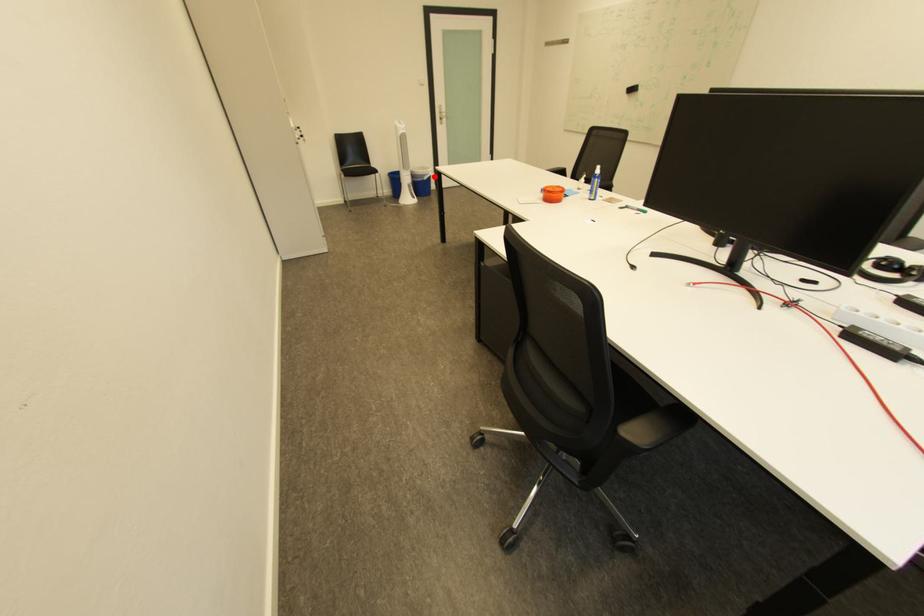
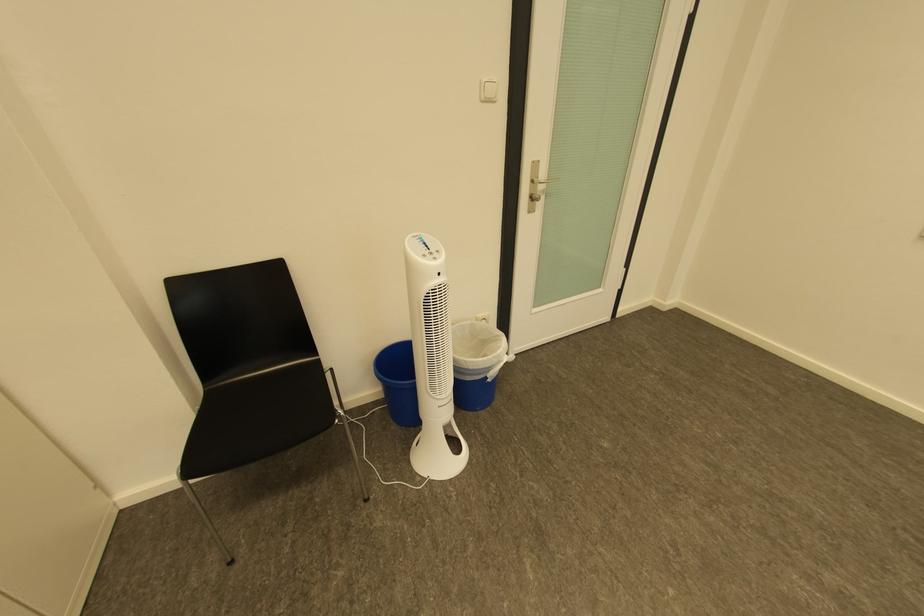
Where in the second image is the point corresponding to the highlighted location from the first image?

(499, 370)